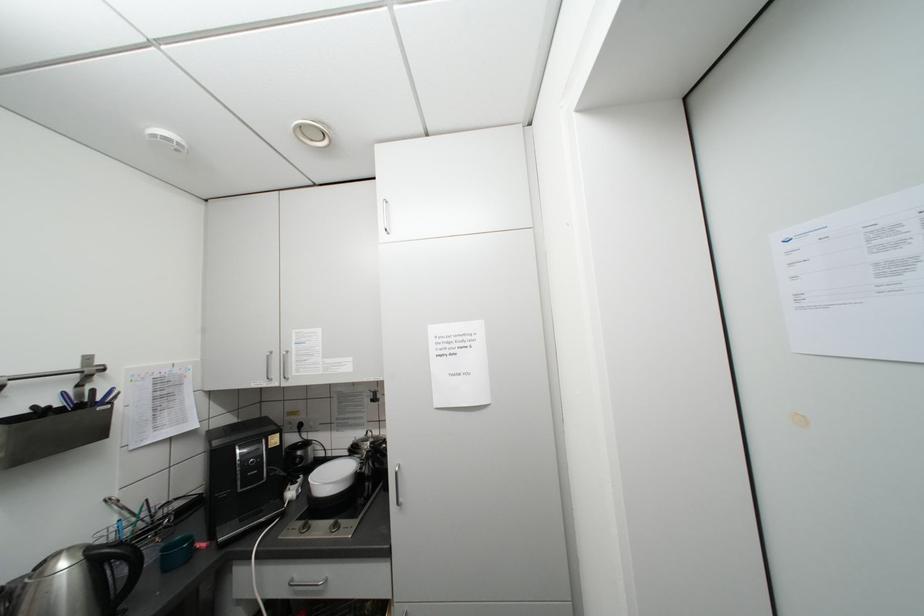
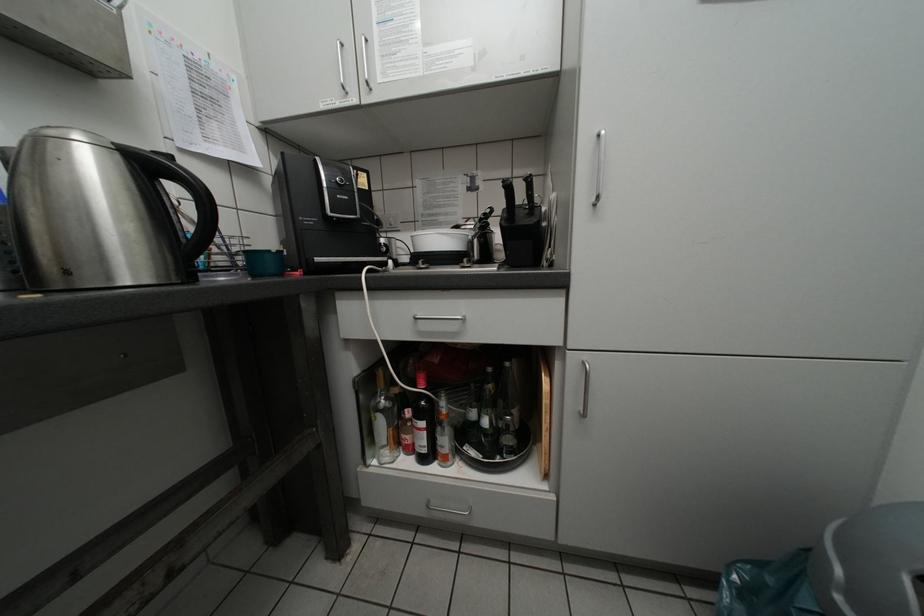
Question: The first image is from the beginning of the video and the second image is from the end. How did the camera likely rotate when shooting the video?

Choices:
 (A) Left
 (B) Right
 (C) Up
 (D) Down

Answer: (D)